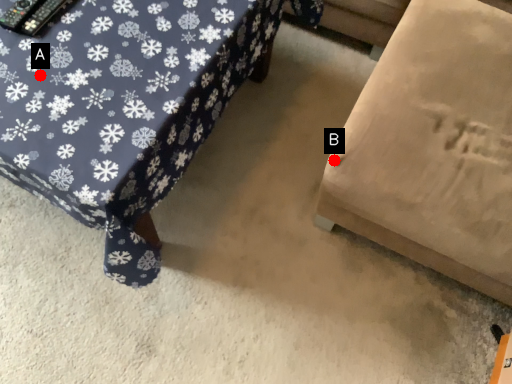
Question: Two points are circled on the image, labeled by A and B beside each circle. Which point is farther to the camera?

Choices:
 (A) A is further
 (B) B is further

Answer: (B)